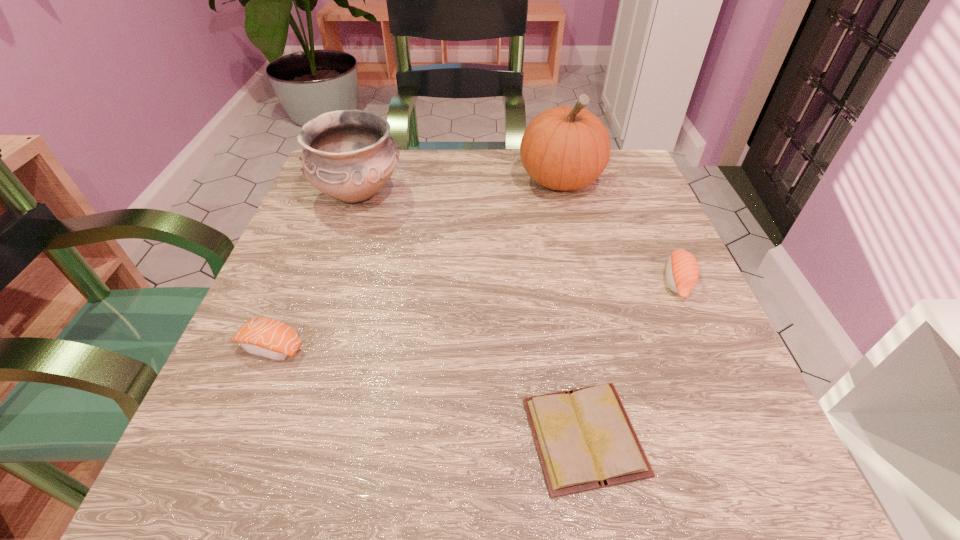
Identify which object is located as the fourth nearest to the nearer sushi. Please provide its 2D coordinates. Your answer should be formatted as a tuple, i.e. [(x, y)], where the tuple contains the x and y coordinates of a point satisfying the conditions above.

[(682, 272)]

Select which object is the third closest to the fourth shortest object. Please provide its 2D coordinates. Your answer should be formatted as a tuple, i.e. [(x, y)], where the tuple contains the x and y coordinates of a point satisfying the conditions above.

[(584, 438)]

The image size is (960, 540). Identify the location of blank space that satisfies the following two spatial constraints: 1. on the front side of the fourth shortest object; 2. on the left side of the taller sushi. (328, 282).

Where is `vacant region that satisfies the following two spatial constraints: 1. on the back side of the fourth tallest object; 2. on the right side of the third nearest object`? The image size is (960, 540). vacant region that satisfies the following two spatial constraints: 1. on the back side of the fourth tallest object; 2. on the right side of the third nearest object is located at coordinates (298, 282).

Locate an element on the screen. vacant area in the image that satisfies the following two spatial constraints: 1. on the back side of the pottery; 2. on the left side of the fourth tallest object is located at coordinates (334, 193).

Locate an element on the screen. vacant space that satisfies the following two spatial constraints: 1. on the front side of the nearest object; 2. on the left side of the nearer sushi is located at coordinates (234, 436).

The width and height of the screenshot is (960, 540). I want to click on blank area in the image that satisfies the following two spatial constraints: 1. on the front side of the nearest object; 2. on the right side of the pottery, so click(x=276, y=436).

Locate an element on the screen. vacant space that satisfies the following two spatial constraints: 1. on the back side of the taller sushi; 2. on the right side of the shorter sushi is located at coordinates (298, 282).